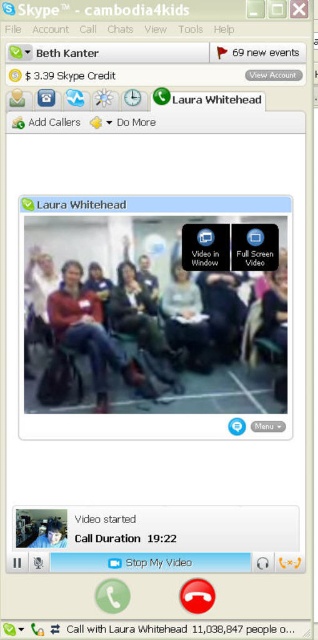
Who is more distant from viewer, [46,250] or [99,372]?

The point [99,372] is behind.

From the picture: Which is below, matte black jacket at center or matte red sweater at center?

Positioned lower is matte red sweater at center.

Does point (154, 403) come behind point (70, 278)?

Yes, it is behind point (70, 278).

This screenshot has width=318, height=640. What are the coordinates of `matte black jacket at center` in the screenshot? It's located at (147, 323).

Does matte black laptop at center have a greater height compared to blue fabric face mask at center?

Indeed, matte black laptop at center has a greater height compared to blue fabric face mask at center.

Between point (199, 353) and point (41, 538), which one is positioned behind?

Point (199, 353)

Which is in front, point (175, 340) or point (50, 524)?

Point (50, 524)

Locate an element on the screen. This screenshot has width=318, height=640. matte black laptop at center is located at coordinates (186, 320).

Between point (55, 300) and point (198, 317), which one is positioned behind?

Point (198, 317)

In the scene shown: Is matte red sweater at center wider than matte black laptop at center?

Correct, the width of matte red sweater at center exceeds that of matte black laptop at center.

Which is behind, point (136, 372) or point (179, 340)?

The point (179, 340) is behind.

I want to click on matte red sweater at center, so click(88, 332).